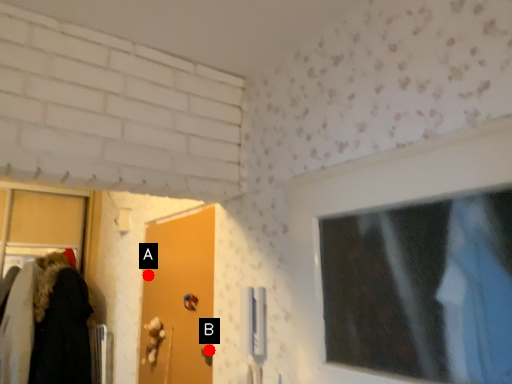
Question: Two points are circled on the image, labeled by A and B beside each circle. Which point is farther from the camera taking this photo?

Choices:
 (A) A is further
 (B) B is further

Answer: (A)